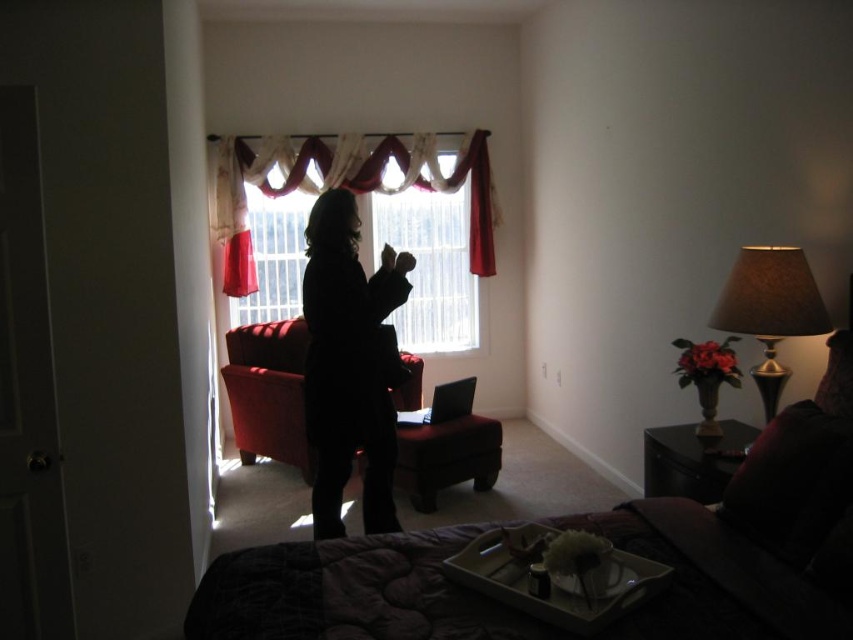
You are organizing a small party in the bedroom and need to place a 1.5 meter long table. Considering the dark fabric bed at center and the brown fabric lampshade at right, which object is more suitable to place the table next to, and why?

The dark fabric bed at center is bigger than the brown fabric lampshade at right, so the table should be placed next to the dark fabric bed at center as it has more space around it.

You are a delivery person who needs to place a small package on the tallest object in the room. Which object should you choose between the dark fabric bed at center and the brown fabric lampshade at right?

The dark fabric bed at center is taller than the brown fabric lampshade at right, so you should place the package on the dark fabric bed at center.

You are organizing the bedroom and need to place a new decorative item between the dark fabric bed at center and the black matte coat at center. Based on their positions, which object should you place the item closer to?

The dark fabric bed at center is to the right of the black matte coat at center, so you should place the decorative item closer to the dark fabric bed at center to maintain symmetry.